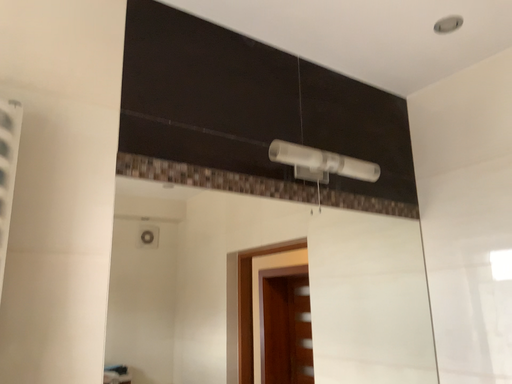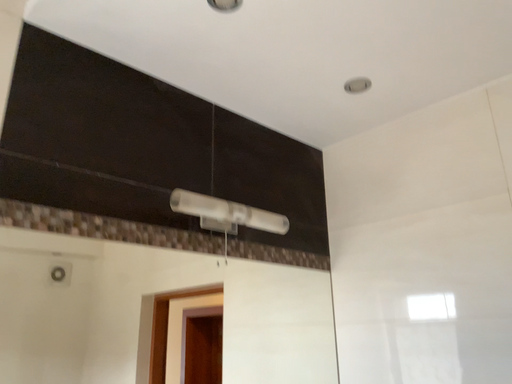
Question: Which way did the camera rotate in the video?

Choices:
 (A) rotated right
 (B) rotated left

Answer: (A)